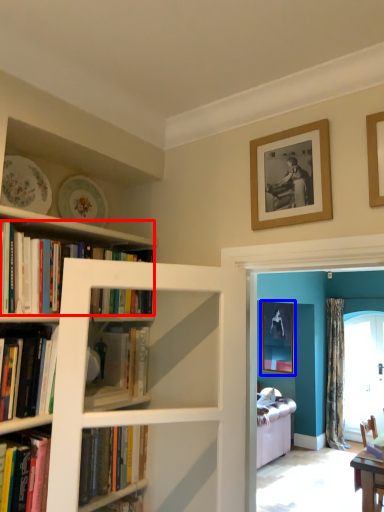
Question: Which object appears closest to the camera in this image, book (highlighted by a red box) or picture frame (highlighted by a blue box)?

Choices:
 (A) book
 (B) picture frame

Answer: (A)